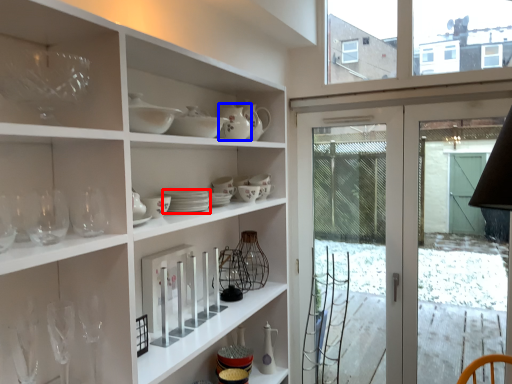
Question: Which point is closer to the camera, tableware (highlighted by a red box) or tableware (highlighted by a blue box)?

Choices:
 (A) tableware
 (B) tableware

Answer: (A)